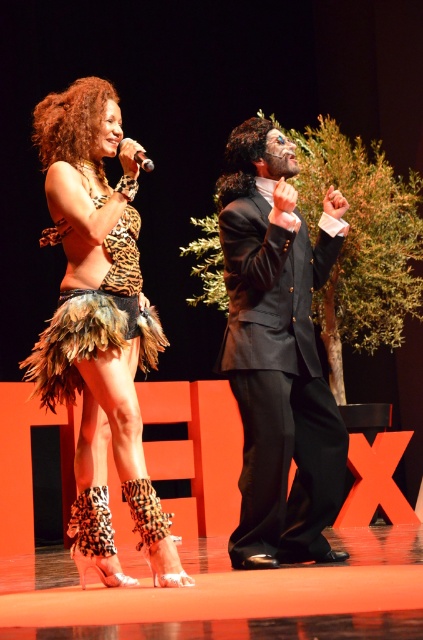
Looking at this image, who is lower down, leopard print feather skirt at center or leopard print fabric skirt at left?

leopard print feather skirt at center is below.

The image size is (423, 640). What do you see at coordinates (98, 324) in the screenshot? I see `leopard print feather skirt at center` at bounding box center [98, 324].

This screenshot has height=640, width=423. I want to click on leopard print feather skirt at center, so click(x=98, y=324).

Who is more distant from viewer, (285, 161) or (128, 305)?

The point (285, 161) is more distant.

Who is shorter, shiny black suit at center or leopard print fabric skirt at left?

With less height is leopard print fabric skirt at left.

Is point (315, 349) closer to viewer compared to point (131, 337)?

That is False.

Find the location of `shiny black suit at center`. shiny black suit at center is located at coordinates (277, 353).

Between point (134, 332) and point (118, 145), which one is positioned in front?

Point (134, 332) is in front.

Can you confirm if leopard print fabric skirt at left is positioned above metallic silver microphone at upper left?

Incorrect, leopard print fabric skirt at left is not positioned above metallic silver microphone at upper left.

I want to click on leopard print fabric skirt at left, so click(x=96, y=321).